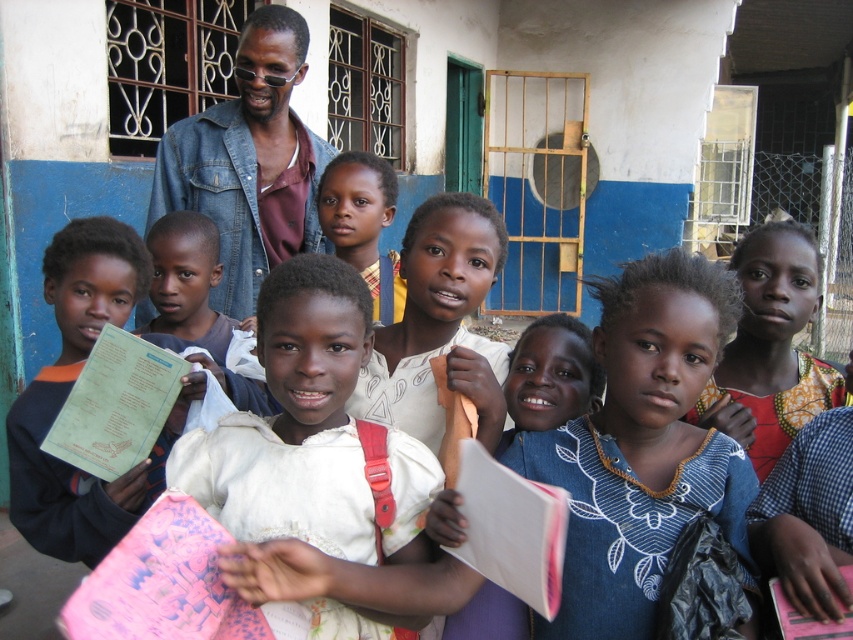
You are a photographer taking a picture of the scene. The matte green book at center and the printed fabric dress at center are both in the frame. Which object is positioned lower in the image?

The matte green book at center is located below the printed fabric dress at center, so it is positioned lower in the image.